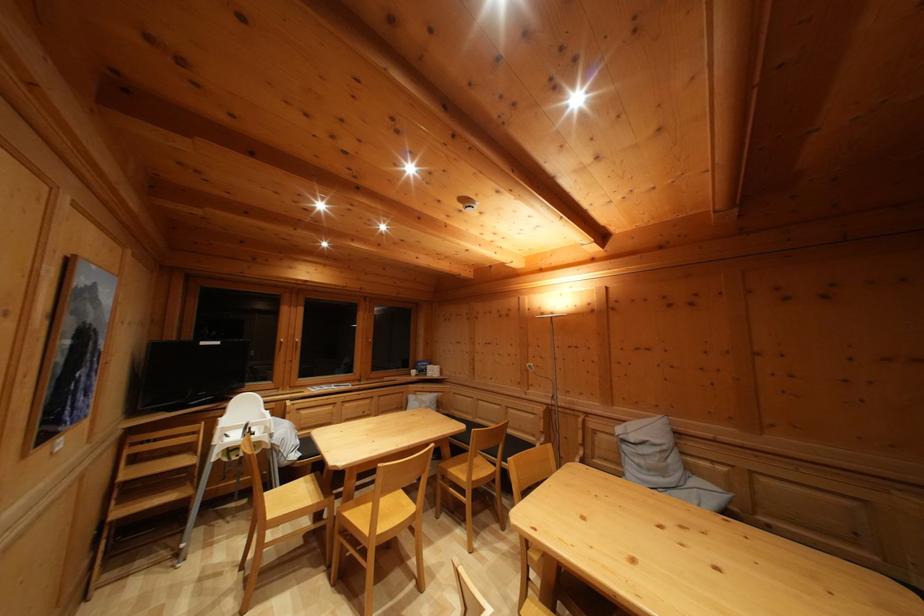
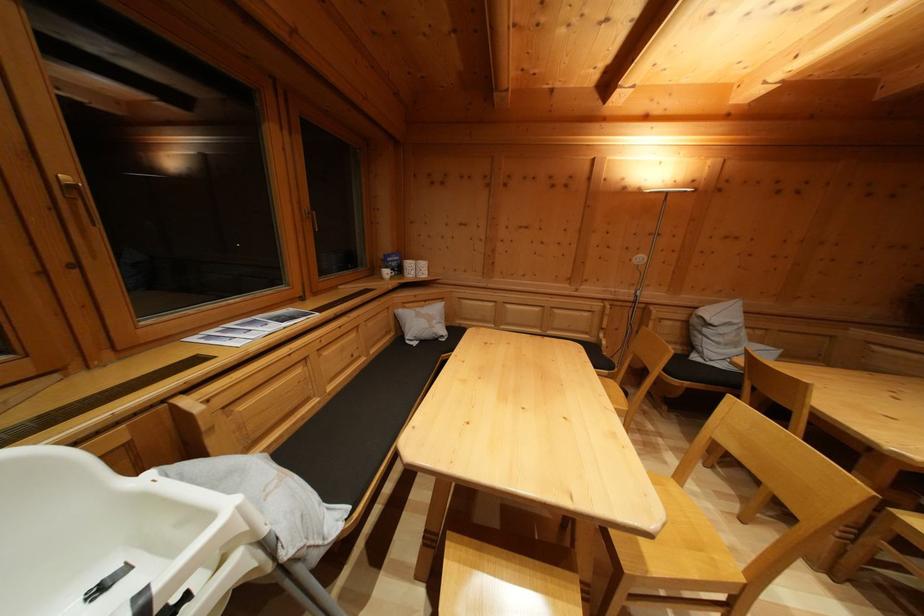
Find the pixel in the second image that matches [629,454] in the first image.

(711, 337)